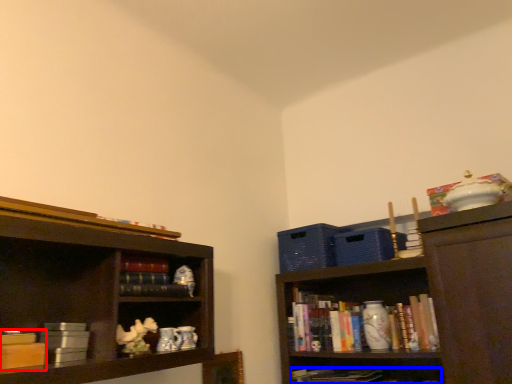
Question: Which of the following is the farthest to the observer, book (highlighted by a red box) or book (highlighted by a blue box)?

Choices:
 (A) book
 (B) book

Answer: (B)